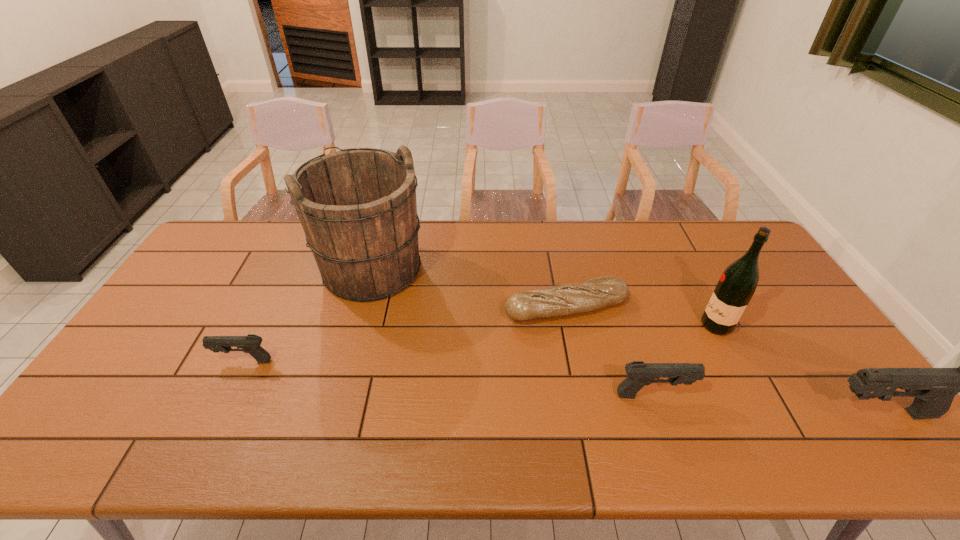
Locate an element on the screen. blank space at the near right corner of the desktop is located at coordinates (850, 412).

Identify the location of blank region between the baguet and the third tallest object. Image resolution: width=960 pixels, height=540 pixels. (724, 361).

Find the location of a particular element. This screenshot has width=960, height=540. vacant area between the second tallest pistol and the shortest object is located at coordinates (611, 352).

The image size is (960, 540). Identify the location of free spot between the second object from left to right and the baguet. (469, 288).

The width and height of the screenshot is (960, 540). I want to click on blank region between the shortest pistol and the fourth shortest object, so click(562, 388).

Locate an element on the screen. The width and height of the screenshot is (960, 540). empty space that is in between the fifth object from right to left and the second nearest object is located at coordinates (513, 332).

You are a GUI agent. You are given a task and a screenshot of the screen. Output one action in this format:
    pyautogui.click(x=<x>, y=<y>)
    Task: Click on the free space between the liquor and the third tallest object
    This screenshot has height=540, width=960.
    Given the screenshot: What is the action you would take?
    pyautogui.click(x=799, y=370)

Identify the location of unoccupied position between the second shortest object and the liquor. The image size is (960, 540). 480,343.

This screenshot has width=960, height=540. I want to click on vacant area that lies between the shortest object and the second object from left to right, so click(x=469, y=288).

The image size is (960, 540). Find the location of `unoccupied area between the second farthest pistol and the nearest object`. unoccupied area between the second farthest pistol and the nearest object is located at coordinates (767, 404).